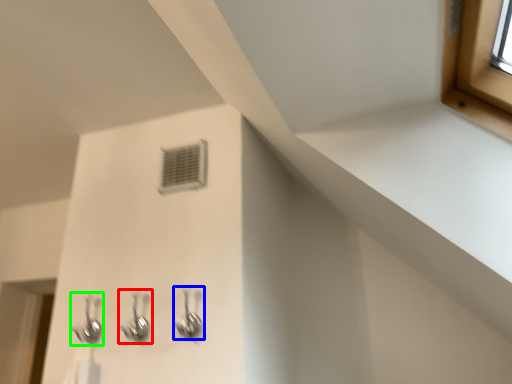
Question: Estimate the real-world distances between objects in this image. Which object is farther from plumbing fixture (highlighted by a red box), plumbing fixture (highlighted by a blue box) or plumbing fixture (highlighted by a green box)?

Choices:
 (A) plumbing fixture
 (B) plumbing fixture

Answer: (A)